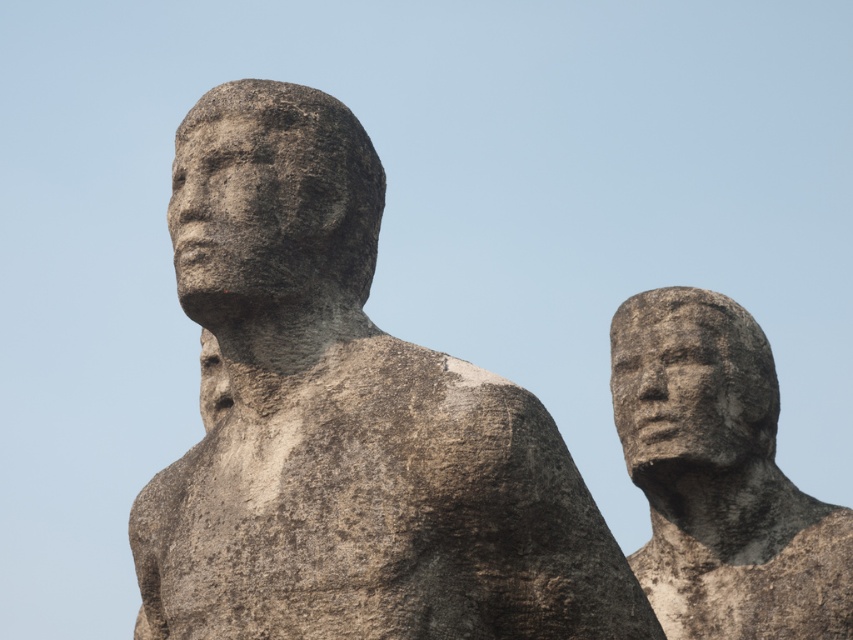
Between gray stone statue at center and gray stone statue at right, which one appears on the right side from the viewer's perspective?

Positioned to the right is gray stone statue at right.

The width and height of the screenshot is (853, 640). I want to click on gray stone statue at center, so click(345, 422).

Describe the element at coordinates (345, 422) in the screenshot. The image size is (853, 640). I see `gray stone statue at center` at that location.

Identify the location of gray stone statue at center. (345, 422).